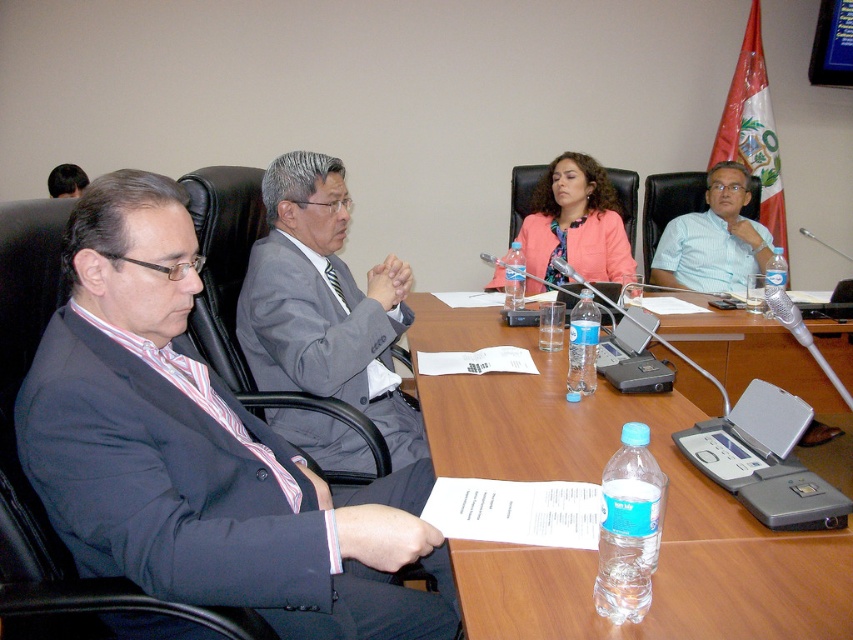
You are a photographer positioned at the back of the room taking a photo of the meeting. You notice the matte black suit at left and the clear plastic water bottle at center. Which object will appear larger in your photo?

The matte black suit at left appears larger in the photo because it is closer to the viewer than the clear plastic water bottle at center.

You are organizing a conference table layout and need to ensure there is enough space between the matte black suit at left and the clear plastic water bottle at center. Based on the scene, can you determine if the space between them is sufficient for placing a standard notebook?

The matte black suit at left might be wider than clear plastic water bottle at center, so the space between them may not be sufficient for placing a standard notebook. Please check the actual dimensions.

You are a photographer standing at the camera position. You need to capture a closeup shot of the matte black suit at left. The camera can focus on objects within 36 inches. Can you take the photo without moving closer?

The matte black suit at left is 37.09 inches from the camera, which is beyond the 36 inches focus range. Therefore, you cannot take the photo without moving closer.